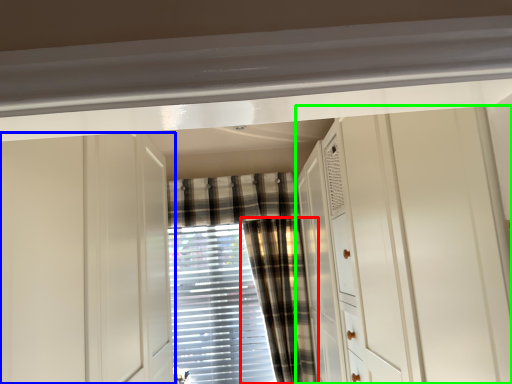
Question: Estimate the real-world distances between objects in this image. Which object is closer to curtain (highlighted by a red box), cabinetry (highlighted by a blue box) or dresser (highlighted by a green box)?

Choices:
 (A) cabinetry
 (B) dresser

Answer: (B)